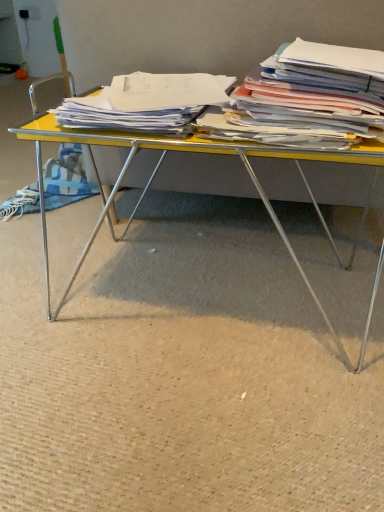
Question: From the image's perspective, is yellow plastic desk at center above white paper stack at right, which is the first magazine in right-to-left order?

Choices:
 (A) no
 (B) yes

Answer: (A)

Question: Is yellow plastic desk at center beside white paper stack at right, which is the first magazine in right-to-left order?

Choices:
 (A) no
 (B) yes

Answer: (A)

Question: Is yellow plastic desk at center facing towards white paper stack at right, placed as the second magazine when sorted from left to right?

Choices:
 (A) no
 (B) yes

Answer: (A)

Question: Is the position of yellow plastic desk at center more distant than that of white paper stack at right, which is the first magazine in right-to-left order?

Choices:
 (A) no
 (B) yes

Answer: (B)

Question: From a real-world perspective, does yellow plastic desk at center stand above white paper stack at right, placed as the second magazine when sorted from left to right?

Choices:
 (A) yes
 (B) no

Answer: (B)

Question: Can you confirm if yellow plastic desk at center is taller than white paper stack at right, placed as the second magazine when sorted from left to right?

Choices:
 (A) yes
 (B) no

Answer: (A)

Question: Is white paper stack at right, placed as the second magazine when sorted from left to right, positioned beyond the bounds of white paper at center, the second magazine viewed from the right?

Choices:
 (A) yes
 (B) no

Answer: (A)

Question: Does white paper stack at right, placed as the second magazine when sorted from left to right, have a smaller size compared to white paper at center, the second magazine viewed from the right?

Choices:
 (A) yes
 (B) no

Answer: (B)

Question: Is white paper stack at right, placed as the second magazine when sorted from left to right, to the right of white paper at center, which is the 1th magazine in left-to-right order, from the viewer's perspective?

Choices:
 (A) no
 (B) yes

Answer: (B)

Question: Is white paper stack at right, which is the first magazine in right-to-left order, facing towards white paper at center, the second magazine viewed from the right?

Choices:
 (A) yes
 (B) no

Answer: (B)

Question: From a real-world perspective, does white paper stack at right, placed as the second magazine when sorted from left to right, stand above white paper at center, the second magazine viewed from the right?

Choices:
 (A) no
 (B) yes

Answer: (B)

Question: Is white paper at center, which is the 1th magazine in left-to-right order, inside white paper stack at right, which is the first magazine in right-to-left order?

Choices:
 (A) yes
 (B) no

Answer: (B)

Question: Considering the relative sizes of white paper at center, which is the 1th magazine in left-to-right order, and yellow plastic desk at center in the image provided, is white paper at center, which is the 1th magazine in left-to-right order, bigger than yellow plastic desk at center?

Choices:
 (A) no
 (B) yes

Answer: (A)